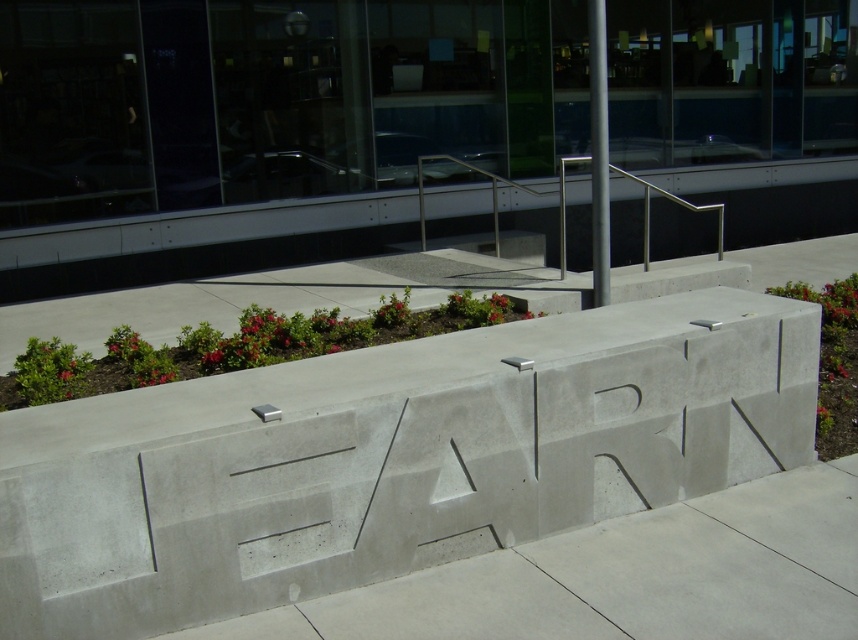
Can you confirm if gray concrete pavement at center is taller than silver metallic pole at center?

In fact, gray concrete pavement at center may be shorter than silver metallic pole at center.

Is the position of gray concrete pavement at center more distant than that of silver metallic pole at center?

That is False.

Is point (681, 561) more distant than point (591, 12)?

No, (681, 561) is in front of (591, 12).

Where is `gray concrete pavement at center`? This screenshot has width=858, height=640. gray concrete pavement at center is located at coordinates (623, 577).

Is gray concrete at center to the left of silver metallic pole at center from the viewer's perspective?

Indeed, gray concrete at center is positioned on the left side of silver metallic pole at center.

Is gray concrete at center wider than silver metallic pole at center?

Indeed, gray concrete at center has a greater width compared to silver metallic pole at center.

Locate an element on the screen. This screenshot has height=640, width=858. gray concrete at center is located at coordinates (388, 458).

Consider the image. Is gray concrete at center shorter than gray concrete pavement at center?

Incorrect, gray concrete at center's height does not fall short of gray concrete pavement at center's.

Between gray concrete at center and gray concrete pavement at center, which one has less height?

With less height is gray concrete pavement at center.

Who is more forward, (104, 589) or (606, 541)?

Point (104, 589) is more forward.

The image size is (858, 640). Find the location of `gray concrete at center`. gray concrete at center is located at coordinates (388, 458).